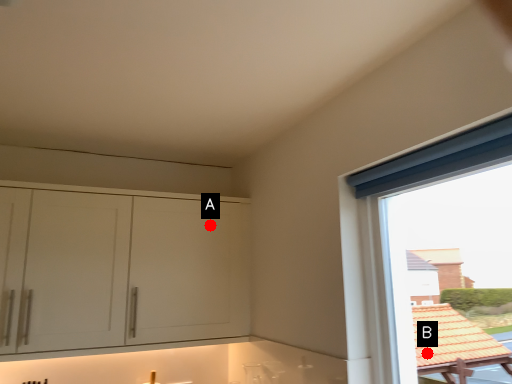
Question: Two points are circled on the image, labeled by A and B beside each circle. Among these points, which one is nearest to the camera?

Choices:
 (A) A is closer
 (B) B is closer

Answer: (B)